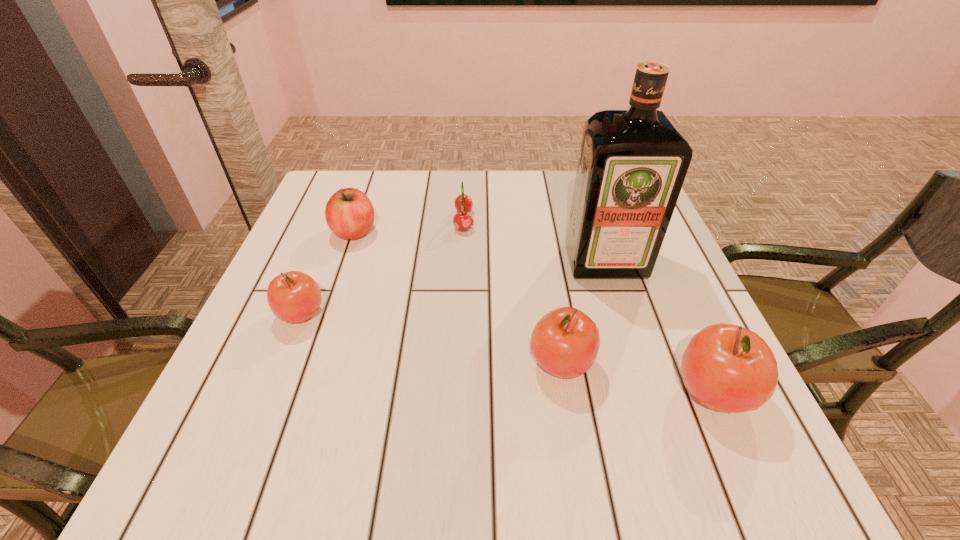
This screenshot has height=540, width=960. In order to click on vacant region located 0.260m on the front label of the tallest object in this screenshot , I will do `click(644, 384)`.

What are the coordinates of `vacant space positioned on the right of the farthest apple` in the screenshot? It's located at (435, 232).

You are a GUI agent. You are given a task and a screenshot of the screen. Output one action in this format:
    pyautogui.click(x=<x>, y=<y>)
    Task: Click on the vacant space located with stems pointing upwards on the fourth object from right to left
    
    Given the screenshot: What is the action you would take?
    pyautogui.click(x=506, y=220)

Where is `apple that is at the far edge`? This screenshot has width=960, height=540. apple that is at the far edge is located at coordinates (349, 213).

Locate an element on the screen. The width and height of the screenshot is (960, 540). cherry present at the far edge is located at coordinates (462, 220).

Locate an element on the screen. apple that is at the right edge is located at coordinates point(728,368).

At what (x,y) coordinates should I click in order to perform the action: click on liquor that is at the right edge. Please return your answer as a coordinate pair (x, y). Looking at the image, I should click on coord(632,164).

Image resolution: width=960 pixels, height=540 pixels. What are the coordinates of `object at the far left corner` in the screenshot? It's located at (349, 213).

You are a GUI agent. You are given a task and a screenshot of the screen. Output one action in this format:
    pyautogui.click(x=<x>, y=<y>)
    Task: Click on the object that is at the near right corner
    This screenshot has width=960, height=540.
    Given the screenshot: What is the action you would take?
    pyautogui.click(x=728, y=368)

The image size is (960, 540). In the image, there is a desktop. Find the location of `vacant space at the far edge`. vacant space at the far edge is located at coordinates (468, 171).